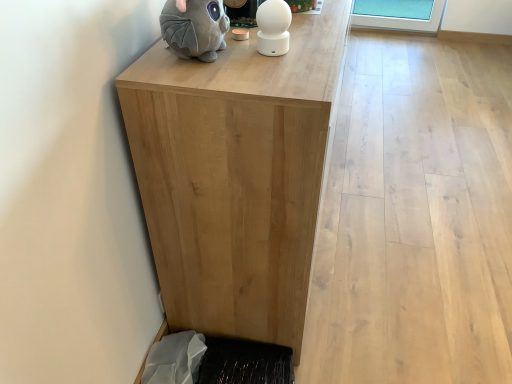
Where is `free space to the back side of white glossy ball at upper center`? free space to the back side of white glossy ball at upper center is located at coordinates (295, 26).